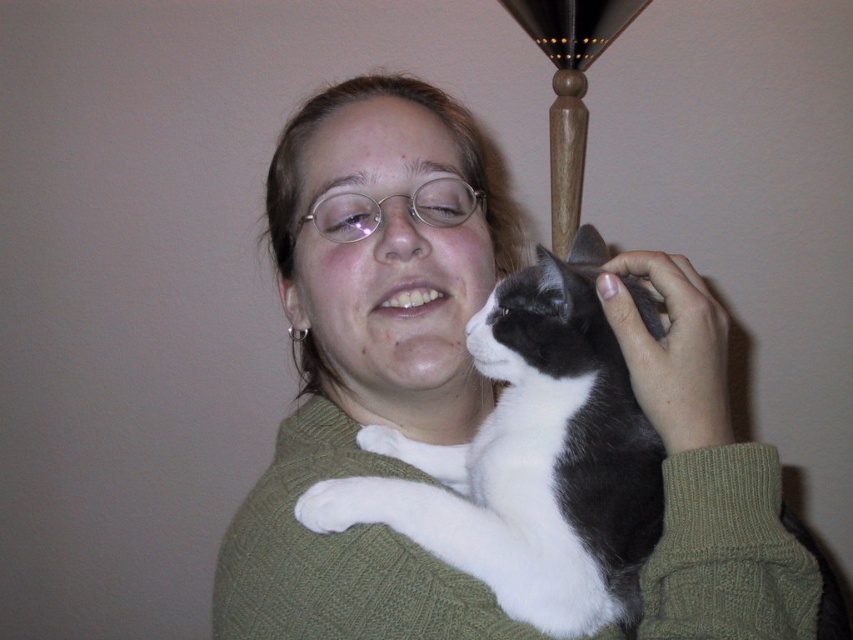
You are a photographer adjusting the focus on your camera. You notice two points in the image at coordinates point (445, 257) and point (575, 525). Which point should you focus on first if you want to ensure the closest object is sharp?

You should focus on point (445, 257) first because it is closer to the camera than point (575, 525).

You are a photographer trying to capture a closeup of the white and gray fur cat at center without including the wooden lampshade at upper center in the frame. Is this possible given their sizes?

The white and gray fur cat at center is smaller than the wooden lampshade at upper center, so it depends on their positions. However, since the cat is at the center and the lampshade is at upper center, adjusting the camera angle to focus on the cat while excluding the lampshade might be feasible if the distance allows.

Based on the scene description, can you determine the relative positions of the white and gray fur cat at center and the wooden lampshade at upper center?

The white and gray fur cat at center is to the left of the wooden lampshade at upper center.